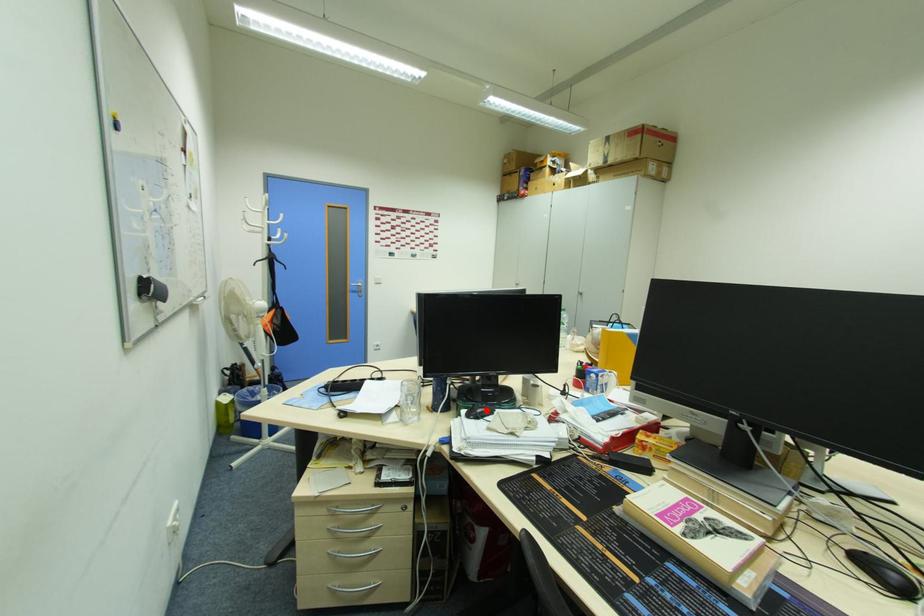
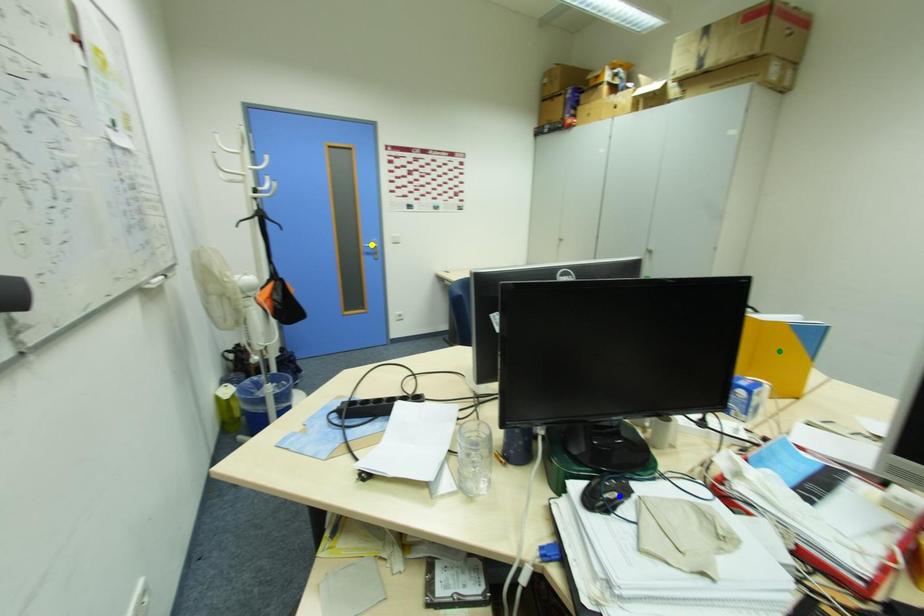
Question: I am providing you with two images of the same scene from different viewpoints. A red point is marked on the first image. You are given multiple points on the second image. Which point in image 2 represents the same 3d spot as the red point in image 1?

Choices:
 (A) green point
 (B) blue point
 (C) yellow point

Answer: (B)